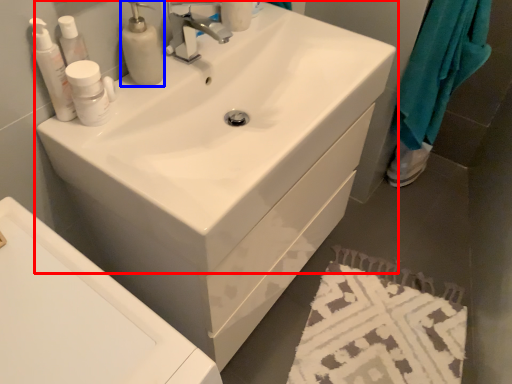
Question: Which object appears closest to the camera in this image, sink (highlighted by a red box) or soap dispenser (highlighted by a blue box)?

Choices:
 (A) sink
 (B) soap dispenser

Answer: (A)